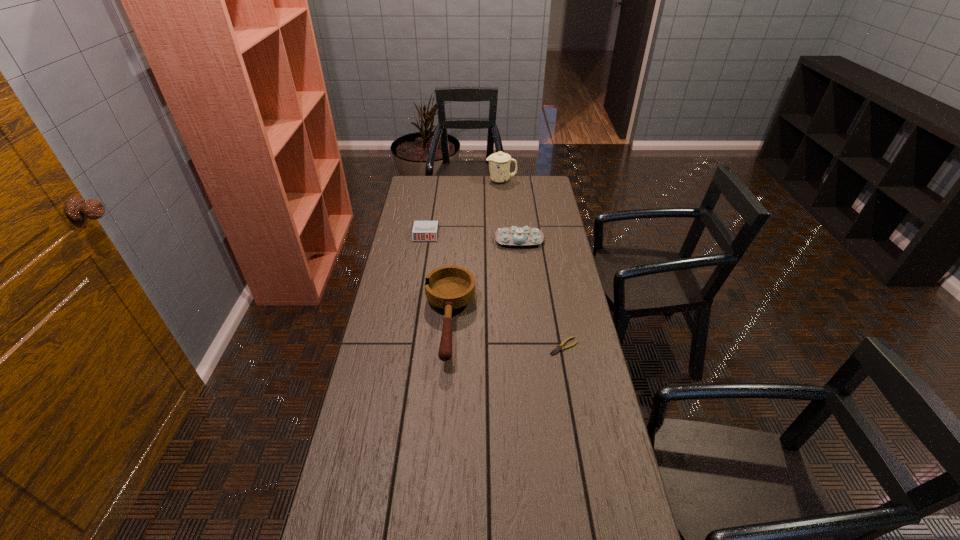
This screenshot has width=960, height=540. Identify the location of the second closest object to the nearer chinaware. (422, 230).

Choose which object is the second nearest neighbor to the saucepan. Please provide its 2D coordinates. Your answer should be formatted as a tuple, i.e. [(x, y)], where the tuple contains the x and y coordinates of a point satisfying the conditions above.

[(559, 347)]

Locate an element on the screen. Image resolution: width=960 pixels, height=540 pixels. vacant space that satisfies the following two spatial constraints: 1. on the spout of the shorter chinaware; 2. on the left side of the farther chinaware is located at coordinates (506, 240).

This screenshot has height=540, width=960. I want to click on vacant area that satisfies the following two spatial constraints: 1. on the spout of the nearer chinaware; 2. on the right side of the farther chinaware, so click(x=506, y=240).

Where is `vacant space that satisfies the following two spatial constraints: 1. on the spout of the taller chinaware; 2. on the back side of the shortest object`? vacant space that satisfies the following two spatial constraints: 1. on the spout of the taller chinaware; 2. on the back side of the shortest object is located at coordinates (514, 346).

The width and height of the screenshot is (960, 540). Find the location of `free space in the image that satisfies the following two spatial constraints: 1. on the spout of the farther chinaware; 2. on the back side of the shorter chinaware`. free space in the image that satisfies the following two spatial constraints: 1. on the spout of the farther chinaware; 2. on the back side of the shorter chinaware is located at coordinates (506, 240).

Where is `free point that satisfies the following two spatial constraints: 1. on the spout of the tallest object; 2. with the handle on the side of the saucepan`? free point that satisfies the following two spatial constraints: 1. on the spout of the tallest object; 2. with the handle on the side of the saucepan is located at coordinates point(512,322).

Locate an element on the screen. The height and width of the screenshot is (540, 960). vacant space that satisfies the following two spatial constraints: 1. on the front side of the shorter chinaware; 2. on the left side of the shortest object is located at coordinates (531, 346).